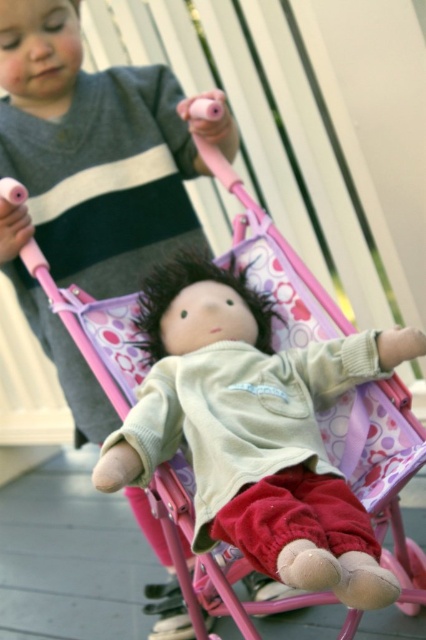
Based on the photo, you are a photographer standing 1.5 meters away from the camera. You want to take a photo of the scene where the point at coordinates point (x=183, y=435) is clearly visible. Is your current distance sufficient to ensure the point is in focus?

The point point (x=183, y=435) is 1.39 meters away from the camera. Since you are standing 1.5 meters away from the camera, your distance is slightly farther than the point, which may affect the focus. To ensure the point is in focus, you might need to adjust your position to be closer to the point or use a lens with a suitable focal length.

From the picture: You are a photographer trying to capture the velvety beige doll at center. Where should you position your camera to ensure the doll is centered in your shot?

To center the velvety beige doll at center in your shot, position your camera so that the doll is at the coordinates 0.672 on the x axis and 0.596 on the y axis.